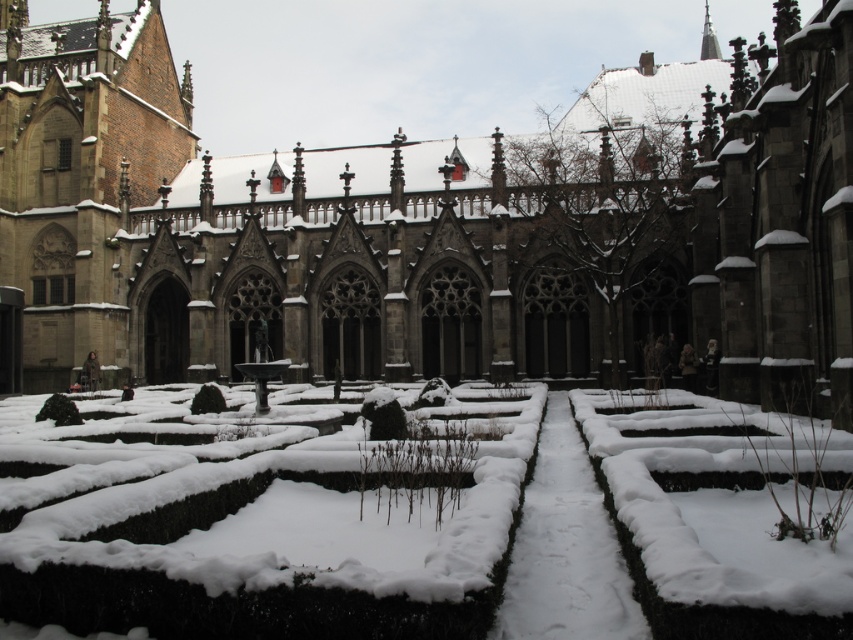
Consider the image. You are standing in a snow covered cloister garden and want to take a photo of the dark gray stone church at center. Your camera has a maximum focus range of 50 meters. Will the church be in focus?

The dark gray stone church at center is 50.45 meters from camera, so it is slightly beyond the camera maximum focus range of 50 meters. The church will not be in focus.

Consider the image. You are standing in the historic cloister garden and want to find the green leafy hedge at lower left. According to the coordinates provided, where exactly should you look to locate it?

The green leafy hedge at lower left is located at point 0.642 on the x axis and 0.070 on the y axis.